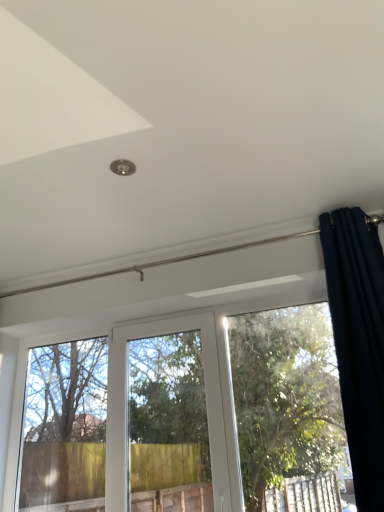
Question: From a real-world perspective, is dark blue velvet curtain at upper right above or below green leafy tree at lower center?

Choices:
 (A) above
 (B) below

Answer: (A)

Question: In terms of width, does dark blue velvet curtain at upper right look wider or thinner when compared to green leafy tree at lower center?

Choices:
 (A) wide
 (B) thin

Answer: (A)

Question: From the image's perspective, is dark blue velvet curtain at upper right positioned above or below green leafy tree at lower center?

Choices:
 (A) above
 (B) below

Answer: (A)

Question: Is green leafy tree at lower center bigger or smaller than dark blue velvet curtain at upper right?

Choices:
 (A) big
 (B) small

Answer: (A)

Question: Is point (170, 415) positioned closer to the camera than point (349, 263)?

Choices:
 (A) farther
 (B) closer

Answer: (A)

Question: Looking at their shapes, would you say green leafy tree at lower center is wider or thinner than dark blue velvet curtain at upper right?

Choices:
 (A) wide
 (B) thin

Answer: (B)

Question: Do you think green leafy tree at lower center is within dark blue velvet curtain at upper right, or outside of it?

Choices:
 (A) outside
 (B) inside

Answer: (A)